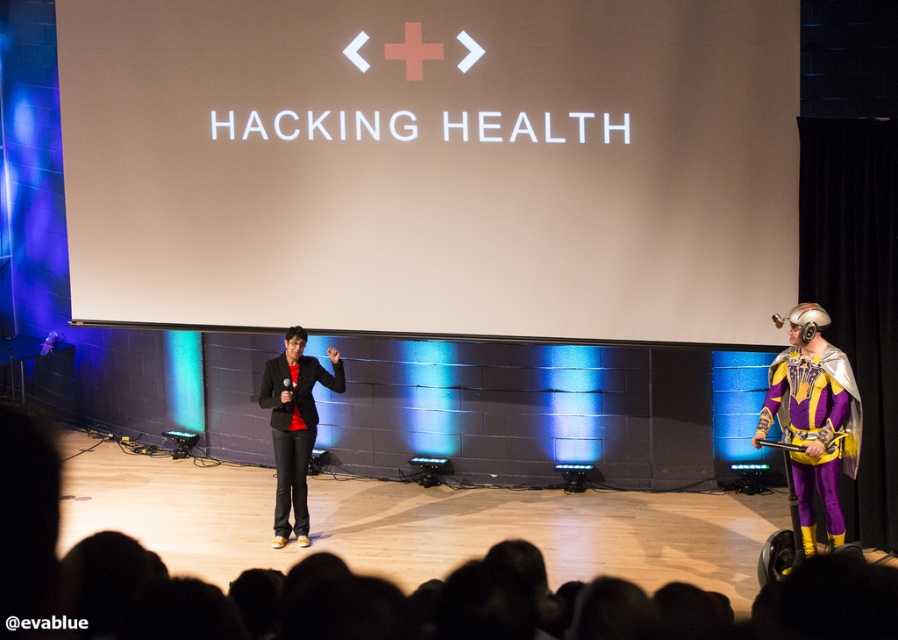
You are an event planner setting up a camera to capture both the speaker and the purple shiny costume at right. The camera can only focus on one position. Where should you place the camera to ensure both are in frame?

The purple shiny costume at right is positioned at point (x=813, y=417), so the camera should be placed to capture both the speaker on the left and the purple shiny costume at right by focusing on the central area between them.

You are an event planner organizing a photo shoot for the stage. You need to position a spotlight that can cover both the purple shiny costume at right and the black matte suit at center. Considering their heights, which object requires the spotlight to be raised higher to ensure proper illumination?

The purple shiny costume at right is much taller than the black matte suit at center, so the spotlight should be raised higher to properly illuminate the purple shiny costume at right.